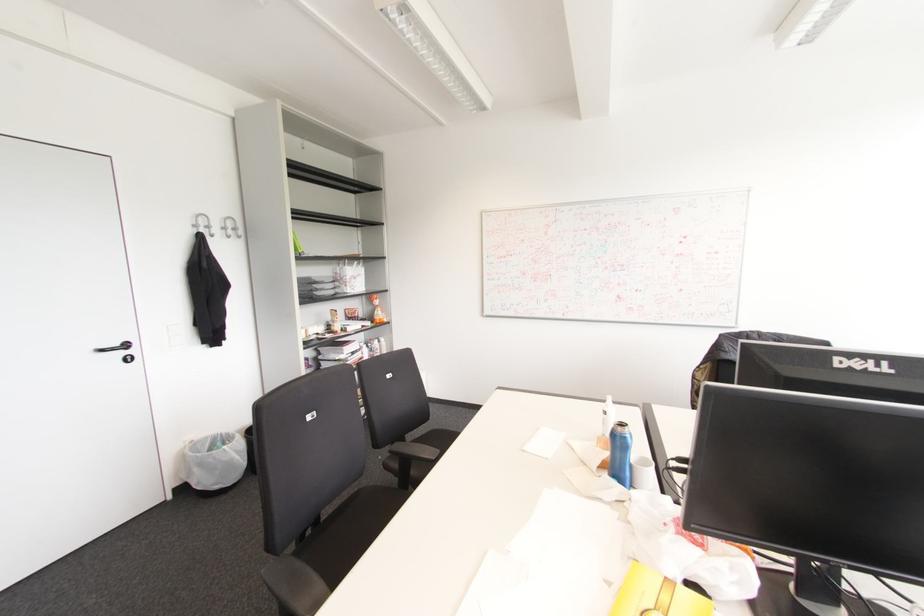
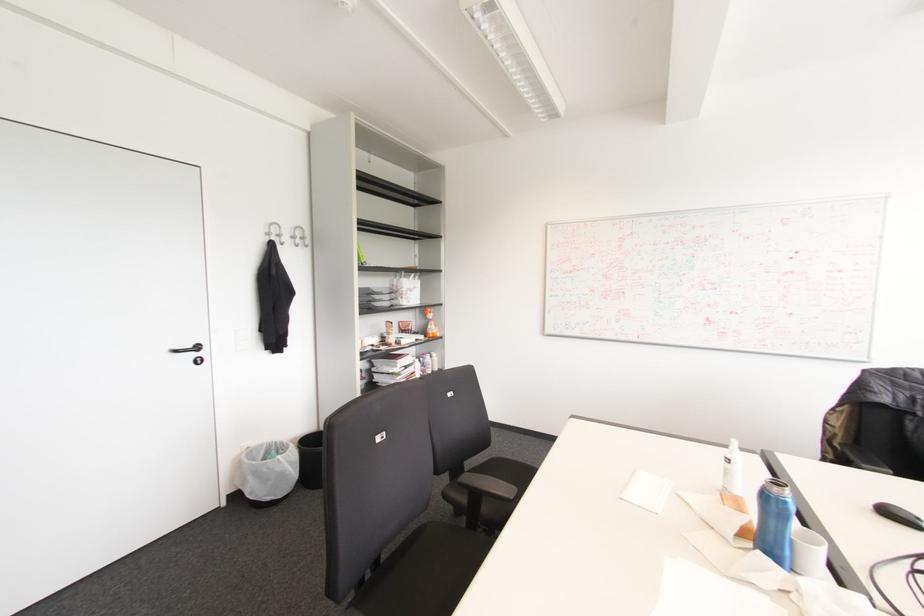
In the second image, find the point that corresponds to pixel 625 438 in the first image.

(784, 503)